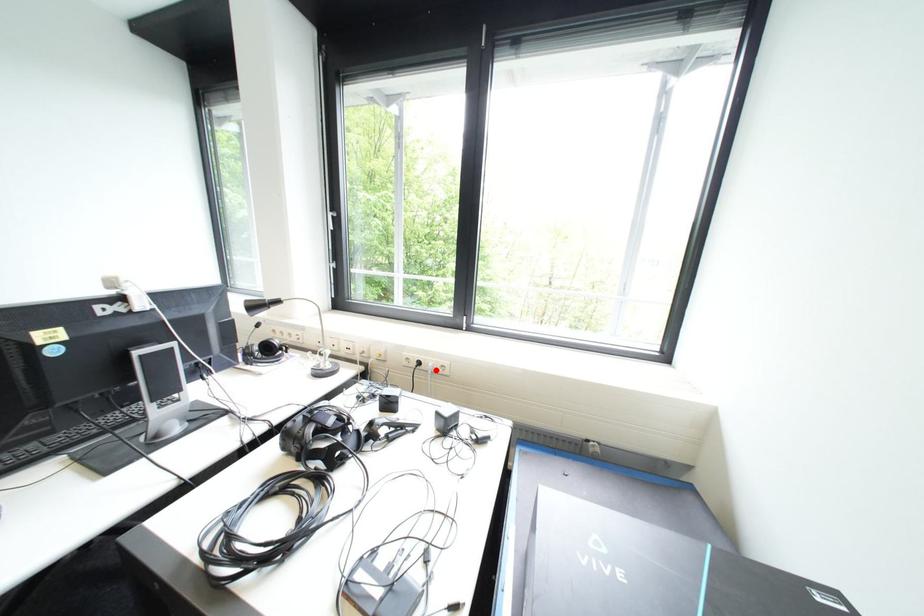
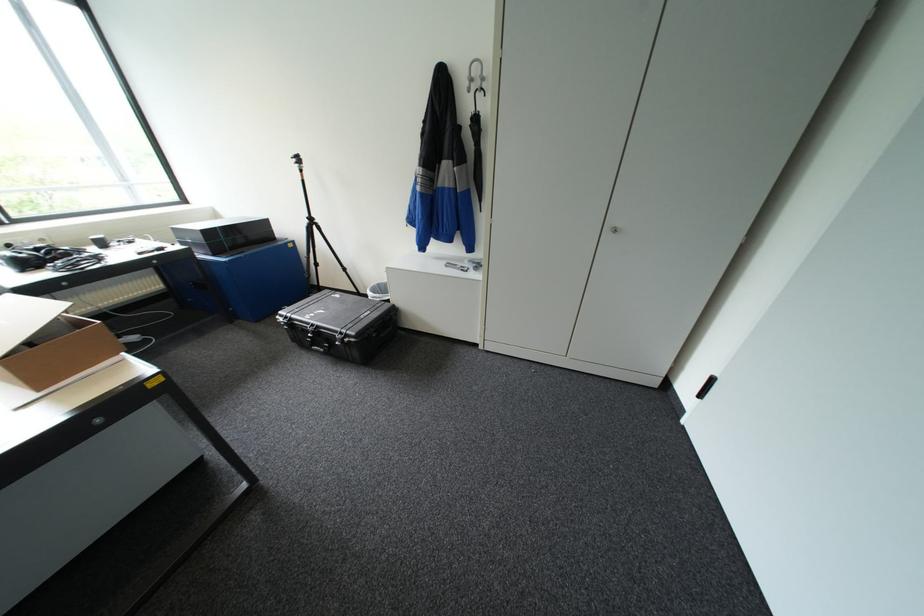
Question: I am providing you with two images of the same scene from different viewpoints. A red point is marked on the first image. Can you still see the location of the red point in image 2?

Choices:
 (A) Yes
 (B) No

Answer: (B)